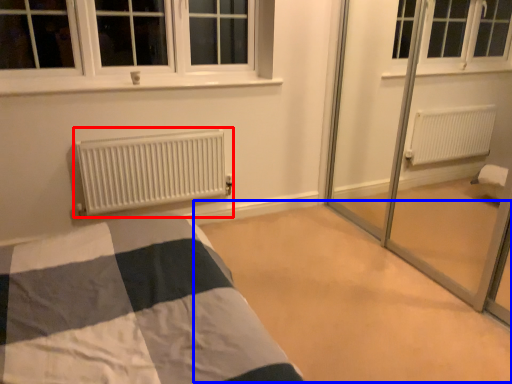
Question: Which point is further to the camera, heater (highlighted by a red box) or plain (highlighted by a blue box)?

Choices:
 (A) heater
 (B) plain

Answer: (A)